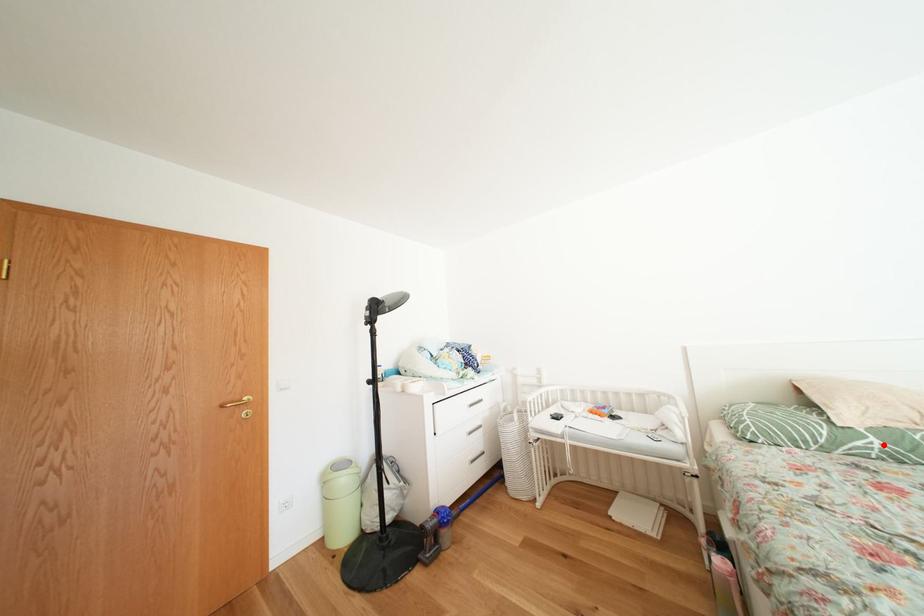
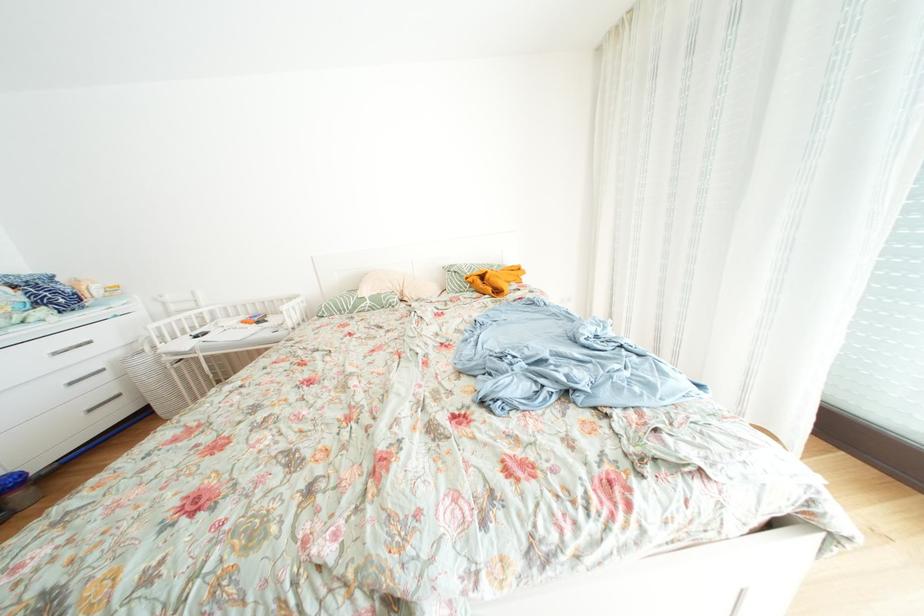
Locate, in the second image, the point that corresponds to the highlighted location in the first image.

(378, 307)